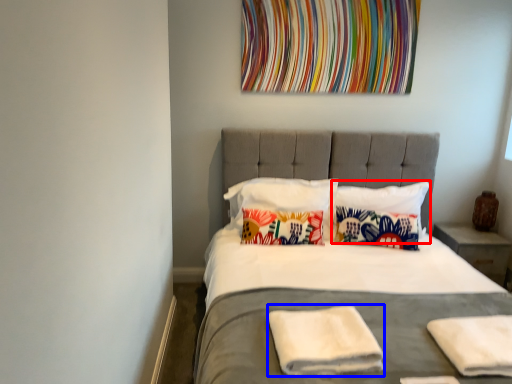
Question: Which object appears farthest to the camera in this image, pillow (highlighted by a red box) or material (highlighted by a blue box)?

Choices:
 (A) pillow
 (B) material

Answer: (A)